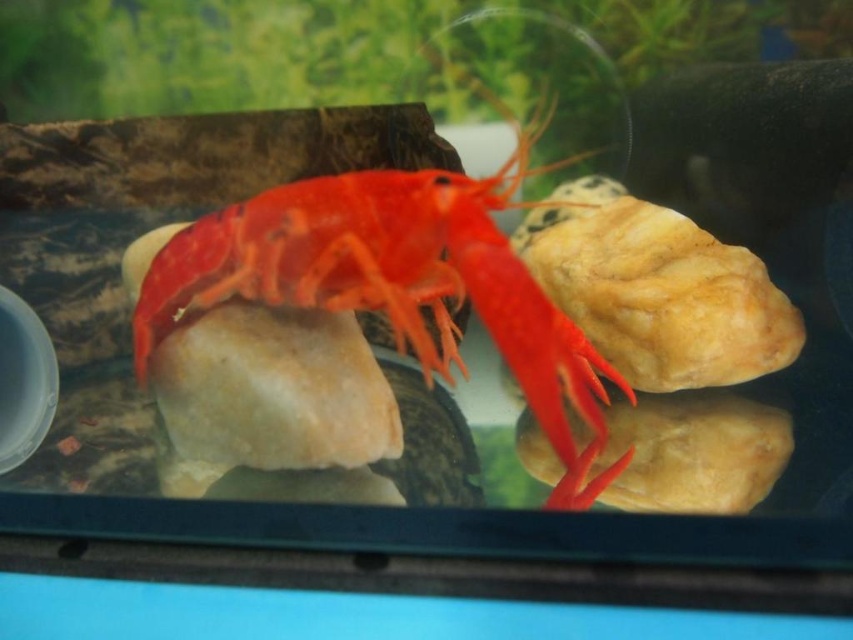
Looking at this image, you are an underwater photographer aiming to capture the shiny orange lobster at center. You need to position your camera so that the lobster is clearly visible against the background. Since the lobster is above the smooth beige rock at center, where should you focus your camera to ensure the lobster is in sharp focus?

The shiny orange lobster at center is located above the smooth beige rock at center, so you should focus your camera on the shiny orange lobster at center to ensure it is in sharp focus.

You are a marine biologist observing the aquarium. You notice the shiny orange lobster at center and the smooth beige rock at center. Which object is positioned closer to your viewpoint?

The shiny orange lobster at center is closer to the viewer than the smooth beige rock at center.